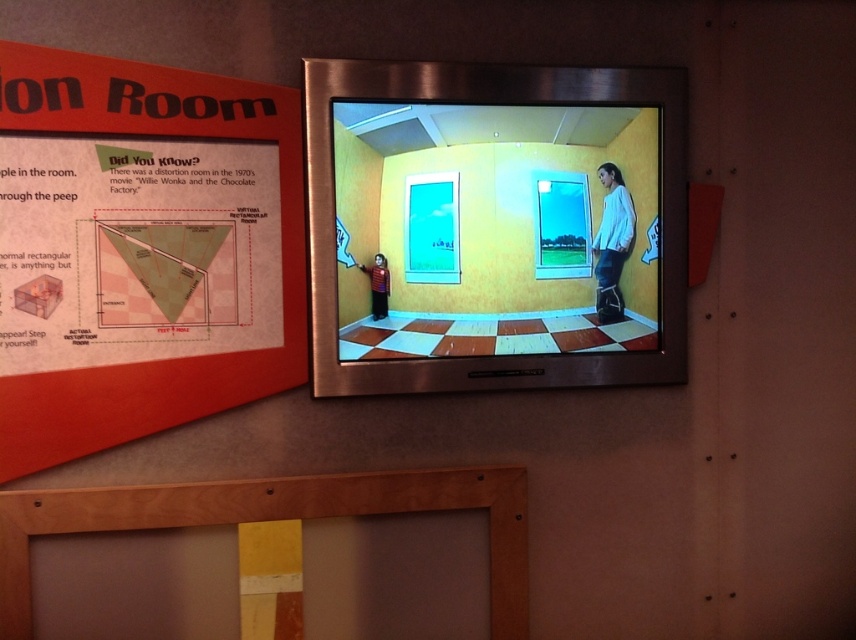
Question: Which of the following is the farthest from the observer?

Choices:
 (A) (370, 273)
 (B) (13, 280)
 (C) (488, 524)

Answer: (C)

Question: Does white matte shirt at upper right appear on the right side of matte red sweater at center?

Choices:
 (A) yes
 (B) no

Answer: (A)

Question: Among these objects, which one is farthest from the camera?

Choices:
 (A) wooden frame at lower center
 (B) matte orange poster at upper left

Answer: (A)

Question: From the image, what is the correct spatial relationship of matte orange poster at upper left in relation to wooden frame at lower center?

Choices:
 (A) above
 (B) below

Answer: (A)

Question: Which object is positioned closest to the matte orange poster at upper left?

Choices:
 (A) white matte shirt at upper right
 (B) matte red sweater at center
 (C) wooden frame at lower center

Answer: (C)

Question: Can you confirm if wooden frame at lower center is positioned below white matte shirt at upper right?

Choices:
 (A) yes
 (B) no

Answer: (A)